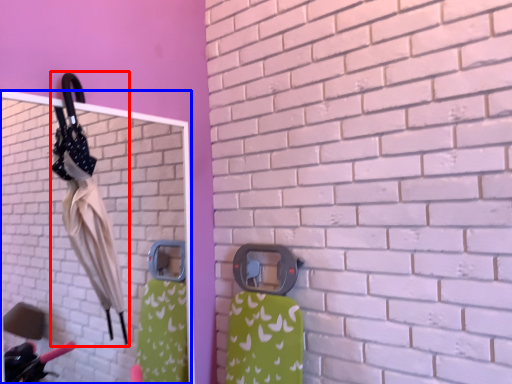
Question: Among these objects, which one is farthest to the camera, umbrella (highlighted by a red box) or mirror (highlighted by a blue box)?

Choices:
 (A) umbrella
 (B) mirror

Answer: (A)